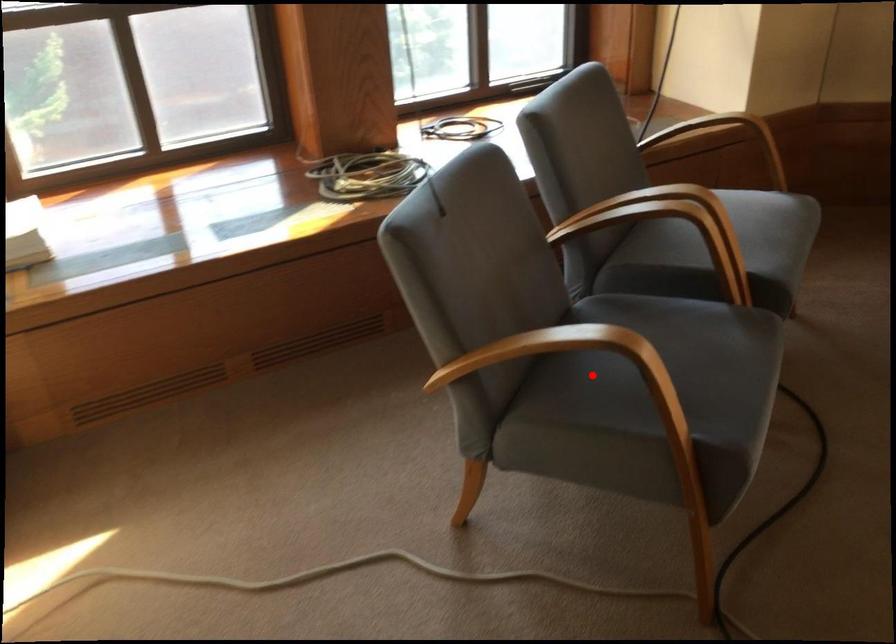
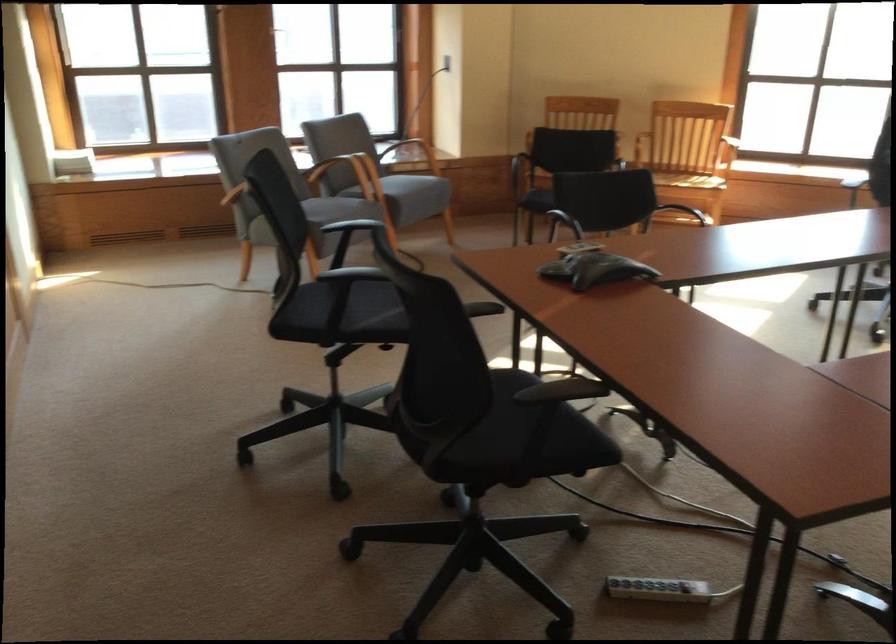
Question: I am providing you with two images of the same scene from different viewpoints. A red point is marked on the first image. At the location where the point appears in image 1, is it still visible in image 2?

Choices:
 (A) Yes
 (B) No

Answer: (B)